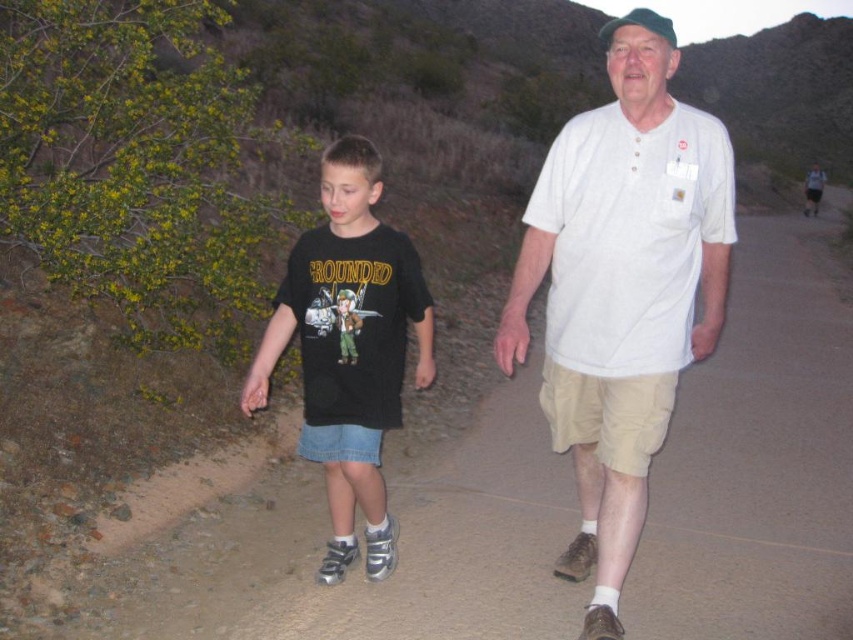
Which is above, white cotton shirt at center or black cotton t-shirt at center?

white cotton shirt at center is higher up.

Which is behind, point (675, 282) or point (311, 449)?

The point (311, 449) is more distant.

Between point (659, 32) and point (328, 308), which one is positioned in front?

Point (659, 32) is in front.

Image resolution: width=853 pixels, height=640 pixels. I want to click on white cotton shirt at center, so click(x=622, y=289).